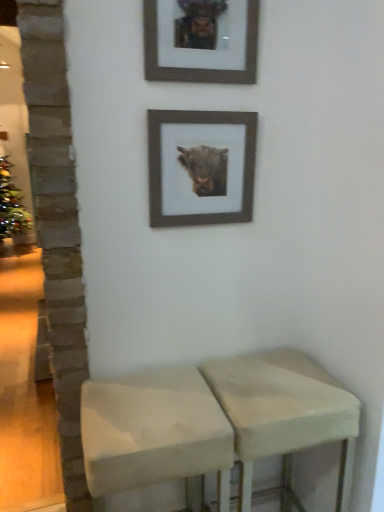
Where is `vacant point above white fabric stool at center, which ranks as the 1th stool in left-to-right order (from a real-world perspective)`? This screenshot has width=384, height=512. vacant point above white fabric stool at center, which ranks as the 1th stool in left-to-right order (from a real-world perspective) is located at coordinates (145, 406).